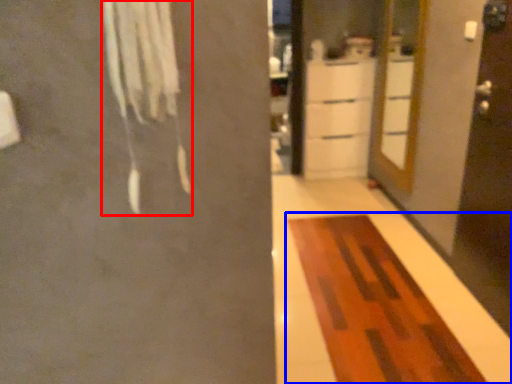
Question: Which of the following is the closest to the observer, laundry (highlighted by a red box) or furniture (highlighted by a blue box)?

Choices:
 (A) laundry
 (B) furniture

Answer: (A)